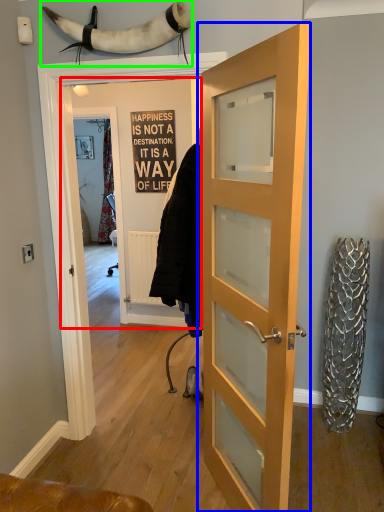
Question: Which is nearer to the door (highlighted by a red box)? door (highlighted by a blue box) or animal (highlighted by a green box).

Choices:
 (A) door
 (B) animal

Answer: (B)